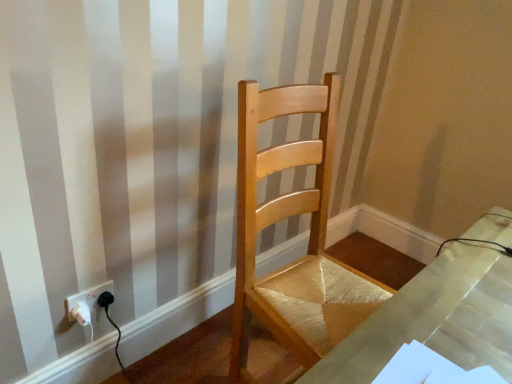
The image size is (512, 384). Identify the location of white plastic socket at lower left. (87, 298).

Describe the element at coordinates (87, 298) in the screenshot. I see `white plastic socket at lower left` at that location.

What do you see at coordinates (309, 238) in the screenshot? I see `natural wood chair at center` at bounding box center [309, 238].

I want to click on natural wood chair at center, so click(x=309, y=238).

I want to click on white plastic socket at lower left, so click(87, 298).

Can you confirm if white plastic socket at lower left is positioned to the right of natural wood chair at center?

Incorrect, white plastic socket at lower left is not on the right side of natural wood chair at center.

From the picture: Does white plastic socket at lower left lie behind natural wood chair at center?

Yes, white plastic socket at lower left is further from the viewer.

Which is nearer, [106,284] or [244,363]?

Clearly, point [106,284] is closer to the camera than point [244,363].

From the image's perspective, is white plastic socket at lower left below natural wood chair at center?

Correct, white plastic socket at lower left appears lower than natural wood chair at center in the image.

From a real-world perspective, is white plastic socket at lower left positioned over natural wood chair at center based on gravity?

Actually, white plastic socket at lower left is physically below natural wood chair at center in the real world.

Considering the sizes of objects white plastic socket at lower left and natural wood chair at center in the image provided, who is wider, white plastic socket at lower left or natural wood chair at center?

With larger width is natural wood chair at center.

Considering the relative sizes of white plastic socket at lower left and natural wood chair at center in the image provided, is white plastic socket at lower left taller than natural wood chair at center?

In fact, white plastic socket at lower left may be shorter than natural wood chair at center.

Considering the sizes of objects white plastic socket at lower left and natural wood chair at center in the image provided, who is bigger, white plastic socket at lower left or natural wood chair at center?

Bigger between the two is natural wood chair at center.

Is white plastic socket at lower left surrounding natural wood chair at center?

No, white plastic socket at lower left does not contain natural wood chair at center.

Are white plastic socket at lower left and natural wood chair at center beside each other?

No, white plastic socket at lower left is not making contact with natural wood chair at center.

Is white plastic socket at lower left positioned with its back to natural wood chair at center?

No, white plastic socket at lower left is not facing the opposite direction of natural wood chair at center.

This screenshot has width=512, height=384. Find the location of `chair above the white plastic socket at lower left (from the image's perspective)`. chair above the white plastic socket at lower left (from the image's perspective) is located at coordinates (309, 238).

Is natural wood chair at center to the left of white plastic socket at lower left from the viewer's perspective?

No.

Which object is further away from the camera, natural wood chair at center or white plastic socket at lower left?

white plastic socket at lower left is further away from the camera.

Is point (355, 278) behind point (68, 315)?

Yes, point (355, 278) is behind point (68, 315).

From the image's perspective, is natural wood chair at center above white plastic socket at lower left?

→ Yes.

From a real-world perspective, is natural wood chair at center over white plastic socket at lower left?

Yes.

Considering the sizes of objects natural wood chair at center and white plastic socket at lower left in the image provided, who is wider, natural wood chair at center or white plastic socket at lower left?

With larger width is natural wood chair at center.

Can you confirm if natural wood chair at center is taller than white plastic socket at lower left?

Indeed, natural wood chair at center has a greater height compared to white plastic socket at lower left.

Which of these two, natural wood chair at center or white plastic socket at lower left, is smaller?

white plastic socket at lower left is smaller.

Is natural wood chair at center not inside white plastic socket at lower left?

natural wood chair at center lies outside white plastic socket at lower left's area.

Is natural wood chair at center far from white plastic socket at lower left?

Actually, natural wood chair at center and white plastic socket at lower left are a little close together.

Is natural wood chair at center turned away from white plastic socket at lower left?

No, natural wood chair at center's orientation is not away from white plastic socket at lower left.

How different are the orientations of natural wood chair at center and white plastic socket at lower left in degrees?

They differ by 5.2 degrees in their facing directions.

At what (x,y) coordinates should I click in order to perform the action: click on chair positioned vertically above the white plastic socket at lower left (from a real-world perspective). Please return your answer as a coordinate pair (x, y). Image resolution: width=512 pixels, height=384 pixels. Looking at the image, I should click on (309, 238).

You are a GUI agent. You are given a task and a screenshot of the screen. Output one action in this format:
    pyautogui.click(x=<x>, y=<y>)
    Task: Click on the electric outlet located below the natural wood chair at center (from the image's perspective)
    This screenshot has width=512, height=384.
    Given the screenshot: What is the action you would take?
    pyautogui.click(x=87, y=298)

Identify the location of chair located above the white plastic socket at lower left (from a real-world perspective). point(309,238).